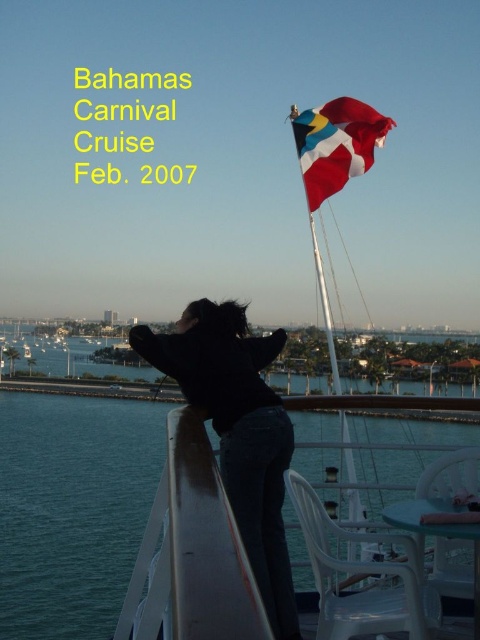
Question: Is blue water at lower left in front of white plastic boat at upper center?

Choices:
 (A) yes
 (B) no

Answer: (B)

Question: Where is white plastic boat at upper center located in relation to black matte jacket at center in the image?

Choices:
 (A) below
 (B) above

Answer: (B)

Question: Considering the real-world distances, which object is farthest from the white plastic boat at upper center?

Choices:
 (A) black matte jacket at center
 (B) blue water at lower left

Answer: (B)

Question: Which point appears closest to the camera in this image?

Choices:
 (A) (312, 163)
 (B) (183, 605)
 (C) (250, 541)
 (D) (210, 333)

Answer: (B)

Question: Is blue water at lower left smaller than black matte jacket at center?

Choices:
 (A) no
 (B) yes

Answer: (A)

Question: Which object is closer to the camera taking this photo?

Choices:
 (A) black matte jacket at center
 (B) red fabric flag at upper center
 (C) white plastic boat at upper center

Answer: (C)